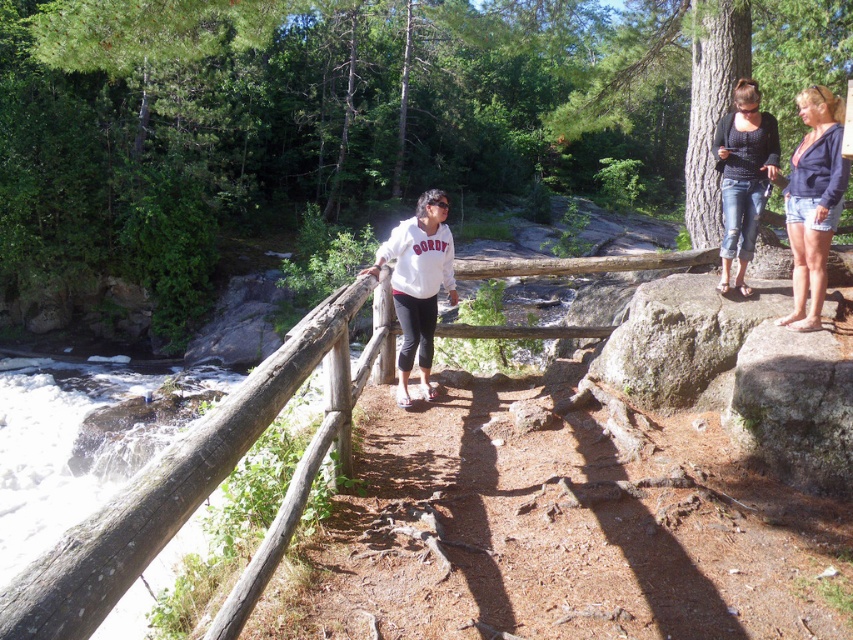
Can you confirm if white frothy water at lower left is smaller than denim jeans at upper right?

Actually, white frothy water at lower left might be larger than denim jeans at upper right.

Can you confirm if white frothy water at lower left is thinner than denim jeans at upper right?

Incorrect, white frothy water at lower left's width is not less than denim jeans at upper right's.

Between point (129, 616) and point (744, 90), which one is positioned behind?

Point (129, 616)

Where is `white frothy water at lower left`? white frothy water at lower left is located at coordinates (77, 445).

Between wooden rail at left and white matte sweatshirt at center, which one is positioned lower?

wooden rail at left

Which is behind, point (119, 593) or point (440, 268)?

The point (440, 268) is more distant.

Between point (221, 470) and point (425, 250), which one is positioned in front?

Point (221, 470) is in front.

In order to click on wooden rail at left in this screenshot , I will do `click(163, 492)`.

Is point (815, 104) farther from camera compared to point (746, 184)?

No.

Does denim shorts at upper right appear on the left side of denim jeans at upper right?

In fact, denim shorts at upper right is to the right of denim jeans at upper right.

Is point (805, 136) closer to viewer compared to point (753, 202)?

Yes, it is in front of point (753, 202).

Where is `denim shorts at upper right`? denim shorts at upper right is located at coordinates tap(813, 204).